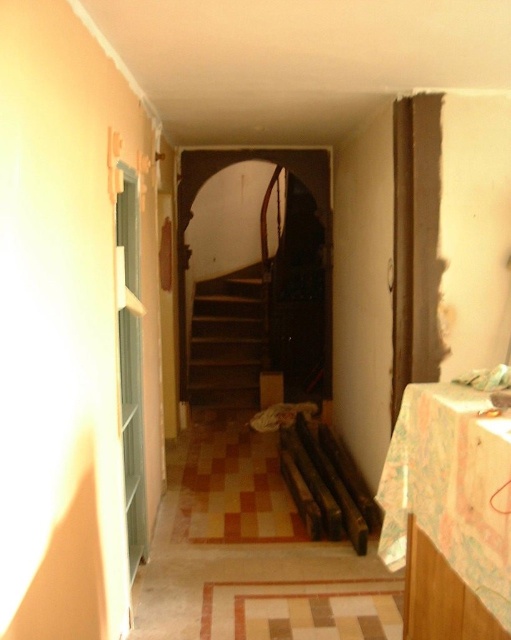
You are a delivery person carrying a large package and need to move from the entrance to the staircase. You see the wooden stairs at center and the wooden at center. Which one is higher and should you step onto first?

The wooden stairs at center is above the wooden at center, so you should step onto the wooden stairs at center first to reach the staircase.

Based on the photo, you are moving a large piece of furniture that is 2 meters wide. You are in the hallway and see the wooden stairs at center and the wooden at center. Which one has enough width to allow the furniture to pass through?

Answer: The wooden stairs at center might be wider than wooden at center, so it is possible that the wooden stairs at center has enough width to allow the furniture to pass through.